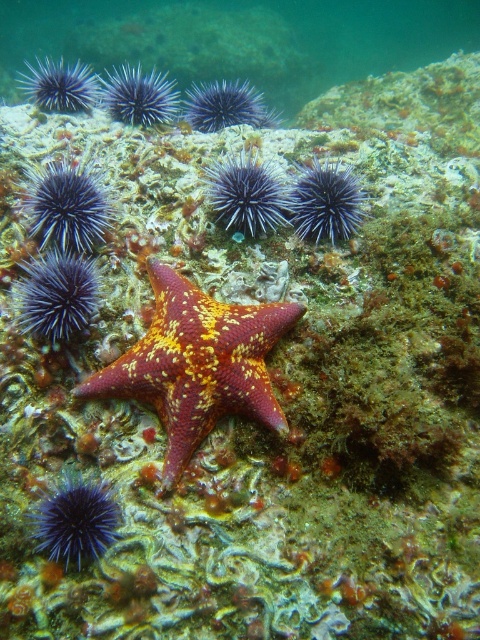
Question: Where is purple spiny sea urchins at upper left located in relation to shiny orange starfish at center in the image?

Choices:
 (A) right
 (B) left

Answer: (A)

Question: Which point appears closest to the camera in this image?

Choices:
 (A) (253, 332)
 (B) (344, 1)

Answer: (A)

Question: Can you confirm if purple spiny sea urchins at upper left is positioned to the left of shiny orange starfish at center?

Choices:
 (A) yes
 (B) no

Answer: (B)

Question: Which point is closer to the camera?

Choices:
 (A) purple spiny sea urchins at upper left
 (B) shiny orange starfish at center

Answer: (B)

Question: Is purple spiny sea urchins at upper left positioned at the back of shiny orange starfish at center?

Choices:
 (A) yes
 (B) no

Answer: (A)